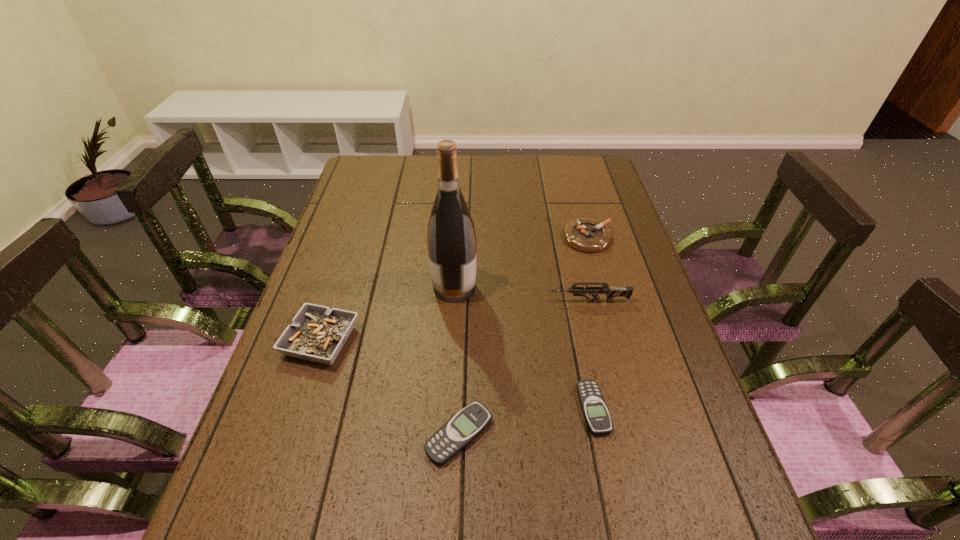
Where is `ashtray situated at the right edge`? The width and height of the screenshot is (960, 540). ashtray situated at the right edge is located at coordinates (588, 235).

What are the coordinates of `gun located in the right edge section of the desktop` in the screenshot? It's located at (611, 292).

The image size is (960, 540). I want to click on free point at the near edge, so click(565, 457).

Locate an element on the screen. The width and height of the screenshot is (960, 540). free space at the left edge is located at coordinates (361, 228).

This screenshot has height=540, width=960. Identify the location of vacant area at the right edge. (613, 313).

Locate an element on the screen. vacant region at the near left corner of the desktop is located at coordinates coord(318,451).

The image size is (960, 540). Identify the location of vacant space at the far right corner of the desktop. (571, 179).

The image size is (960, 540). I want to click on empty location between the tallest object and the shorter beeper, so click(524, 348).

The image size is (960, 540). Find the location of `vacant space that is in between the farthest object and the taller beeper`. vacant space that is in between the farthest object and the taller beeper is located at coordinates (523, 336).

Locate an element on the screen. This screenshot has width=960, height=540. vacant area that lies between the shorter beeper and the right ashtray is located at coordinates (590, 323).